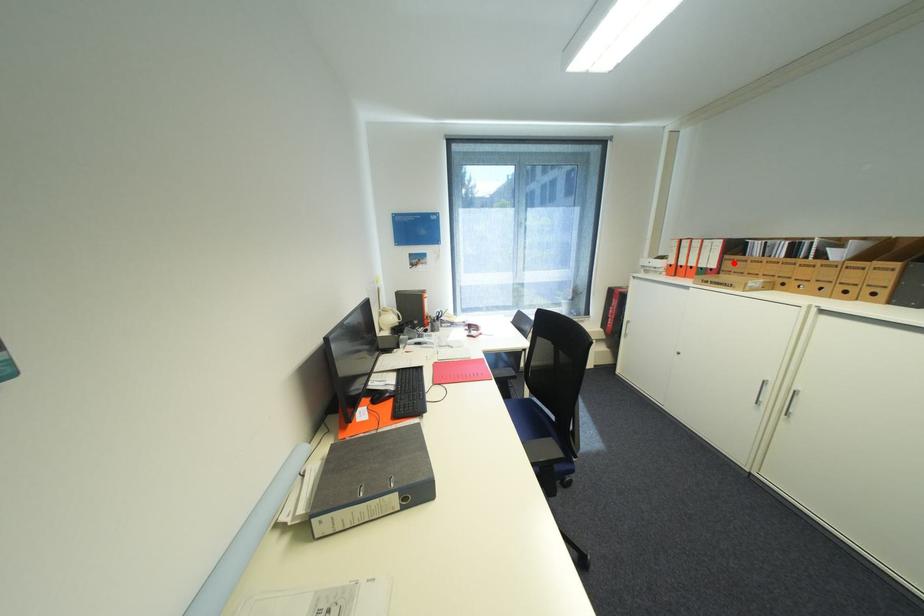
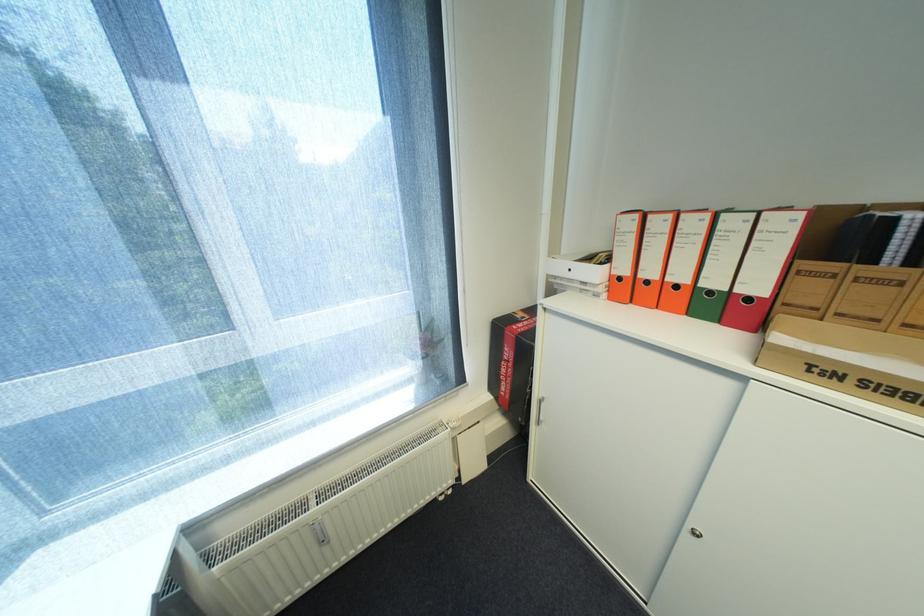
The point at the highlighted location is marked in the first image. Where is the corresponding point in the second image?

(806, 282)